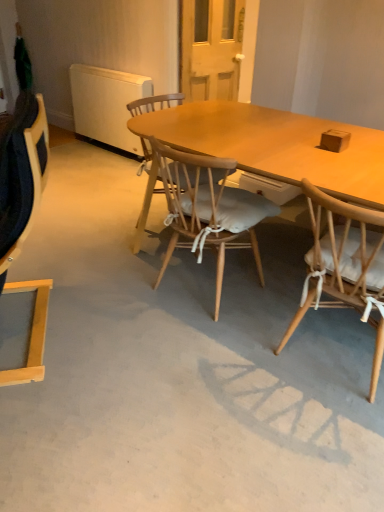
Question: Does brown matte box at upper right have a greater width compared to wooden chair with white cushion at right, the 3th chair from the left?

Choices:
 (A) no
 (B) yes

Answer: (A)

Question: Are brown matte box at upper right and wooden chair with white cushion at right, placed as the 1th chair when sorted from right to left, beside each other?

Choices:
 (A) yes
 (B) no

Answer: (B)

Question: From the image's perspective, is brown matte box at upper right under wooden chair with white cushion at right, placed as the 1th chair when sorted from right to left?

Choices:
 (A) no
 (B) yes

Answer: (A)

Question: From a real-world perspective, is brown matte box at upper right over wooden chair with white cushion at right, placed as the 1th chair when sorted from right to left?

Choices:
 (A) no
 (B) yes

Answer: (B)

Question: Considering the relative sizes of brown matte box at upper right and wooden chair with white cushion at right, placed as the 1th chair when sorted from right to left, in the image provided, is brown matte box at upper right smaller than wooden chair with white cushion at right, placed as the 1th chair when sorted from right to left,?

Choices:
 (A) yes
 (B) no

Answer: (A)

Question: Considering the positions of wooden chair with cushion at center, arranged as the second chair when viewed from the left, and brown matte box at upper right in the image, is wooden chair with cushion at center, arranged as the second chair when viewed from the left, taller or shorter than brown matte box at upper right?

Choices:
 (A) tall
 (B) short

Answer: (A)

Question: Considering the positions of wooden chair with cushion at center, acting as the second chair starting from the right, and brown matte box at upper right in the image, is wooden chair with cushion at center, acting as the second chair starting from the right, bigger or smaller than brown matte box at upper right?

Choices:
 (A) big
 (B) small

Answer: (A)

Question: Considering the positions of point (238, 231) and point (337, 139), is point (238, 231) closer or farther from the camera than point (337, 139)?

Choices:
 (A) farther
 (B) closer

Answer: (A)

Question: From a real-world perspective, is wooden chair with cushion at center, acting as the second chair starting from the right, positioned above or below brown matte box at upper right?

Choices:
 (A) below
 (B) above

Answer: (A)

Question: Is light wood chair at left, marked as the third chair in a right-to-left arrangement, spatially inside wooden chair with cushion at center, arranged as the second chair when viewed from the left, or outside of it?

Choices:
 (A) outside
 (B) inside

Answer: (A)

Question: Is light wood chair at left, marked as the third chair in a right-to-left arrangement, wider or thinner than wooden chair with cushion at center, arranged as the second chair when viewed from the left?

Choices:
 (A) wide
 (B) thin

Answer: (B)

Question: Considering the positions of point (34, 345) and point (218, 243), is point (34, 345) closer or farther from the camera than point (218, 243)?

Choices:
 (A) closer
 (B) farther

Answer: (A)

Question: In terms of size, does light wood chair at left, marked as the third chair in a right-to-left arrangement, appear bigger or smaller than wooden chair with cushion at center, acting as the second chair starting from the right?

Choices:
 (A) big
 (B) small

Answer: (A)

Question: From the image's perspective, is brown matte box at upper right located above or below wooden chair with white cushion at right, placed as the 1th chair when sorted from right to left?

Choices:
 (A) below
 (B) above

Answer: (B)

Question: From their relative heights in the image, would you say brown matte box at upper right is taller or shorter than wooden chair with white cushion at right, the 3th chair from the left?

Choices:
 (A) short
 (B) tall

Answer: (A)